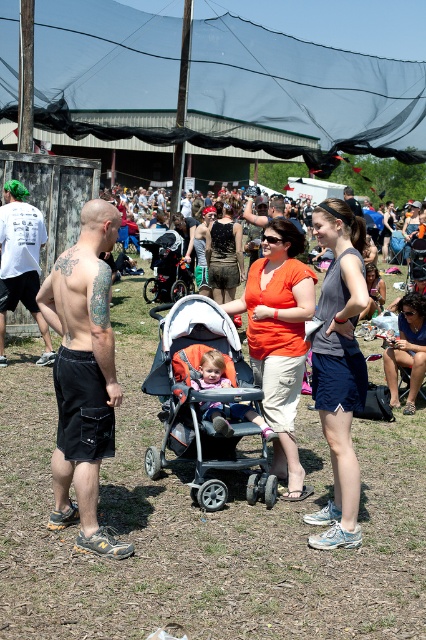
You are a photographer trying to capture a photo of the black mesh canopy at upper center and the black matte shorts at left. Which object is higher in the image?

The black mesh canopy at upper center is taller than the black matte shorts at left, so the black mesh canopy at upper center is higher in the image.

What is located at the point with coordinates (x=305, y=84)?

The black mesh canopy at upper center is located at point (x=305, y=84).

You are organizing a photo shoot and need to ensure that all subjects are visible in the frame. Given the black matte shorts at left and the orange matte shirt at center, which object should you focus on to ensure both are captured clearly?

You should focus on the orange matte shirt at center because it occupies more space and will be easier to capture clearly in the frame, ensuring the smaller black matte shorts at left is also visible.